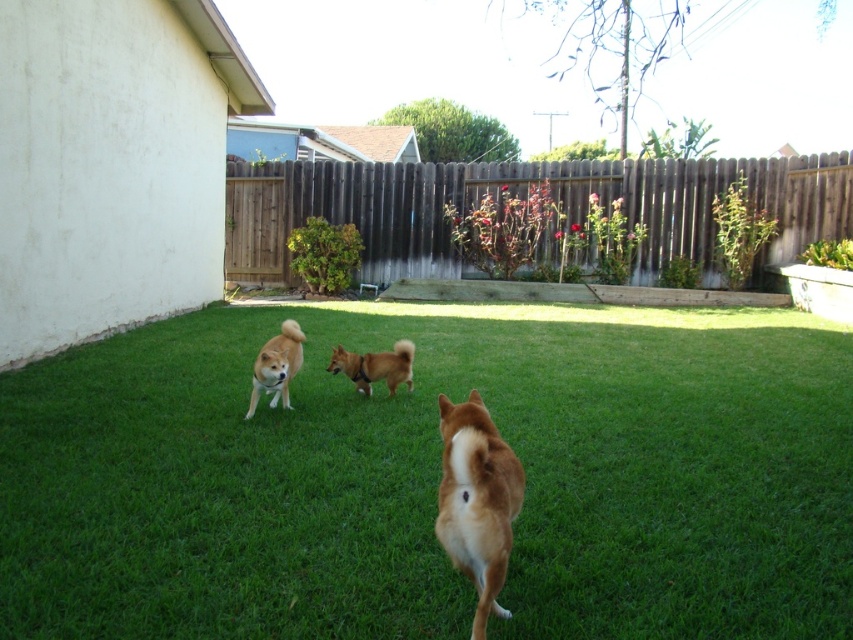
Question: Is brown furry dog at center below brown fur dog at center?

Choices:
 (A) yes
 (B) no

Answer: (A)

Question: Is brown furry dog at center smaller than brown fur dog at center?

Choices:
 (A) no
 (B) yes

Answer: (A)

Question: Which point is farther to the camera?

Choices:
 (A) (225, 616)
 (B) (473, 429)
 (C) (347, 353)
 (D) (300, 344)

Answer: (D)

Question: Does brown furry dog at center appear on the left side of light brown fur at center?

Choices:
 (A) no
 (B) yes

Answer: (A)

Question: Which object is farther from the camera taking this photo?

Choices:
 (A) brown furry dog at center
 (B) green grass at center

Answer: (B)

Question: Which object appears closest to the camera in this image?

Choices:
 (A) light brown fur at center
 (B) brown fur dog at center

Answer: (A)